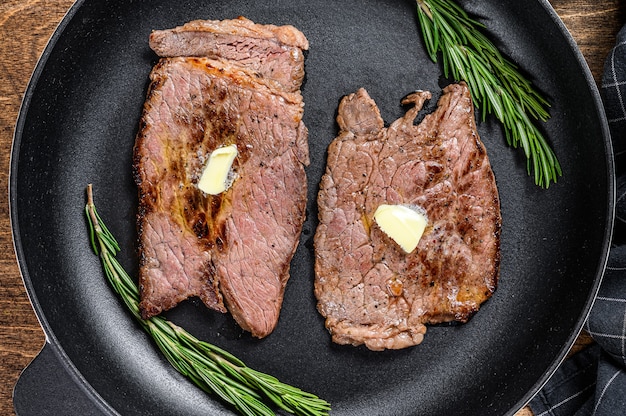
Where is `black handle on plate`? The image size is (626, 416). black handle on plate is located at coordinates (53, 387).